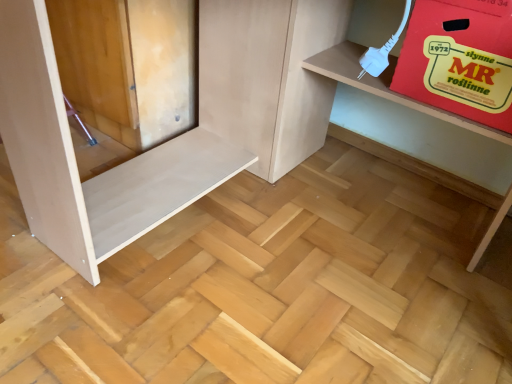
You are a GUI agent. You are given a task and a screenshot of the screen. Output one action in this format:
    pyautogui.click(x=<x>, y=<y>)
    Task: Click on the free region under matte cardboard box at upper right (from a real-world perspective)
    The image size is (512, 384).
    Given the screenshot: What is the action you would take?
    pyautogui.click(x=301, y=236)